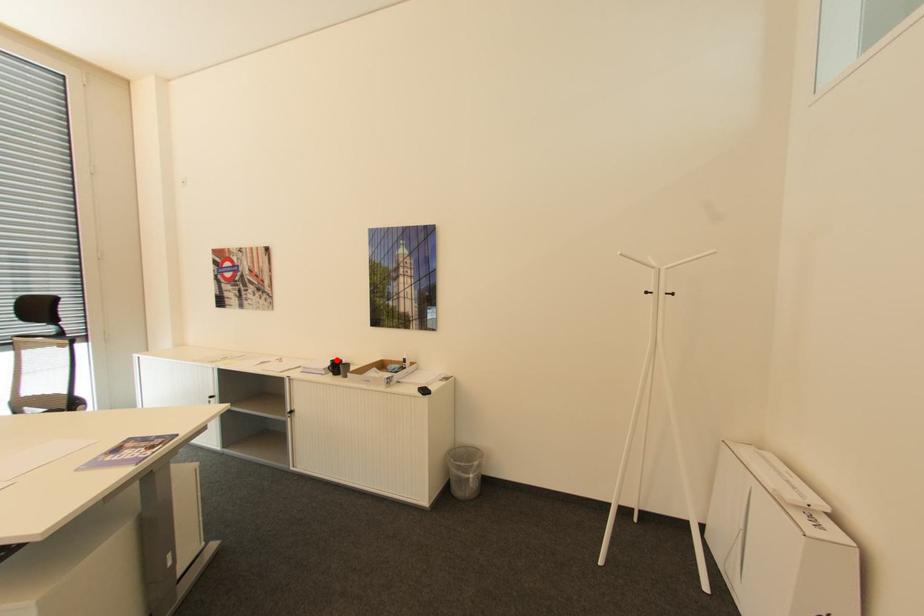
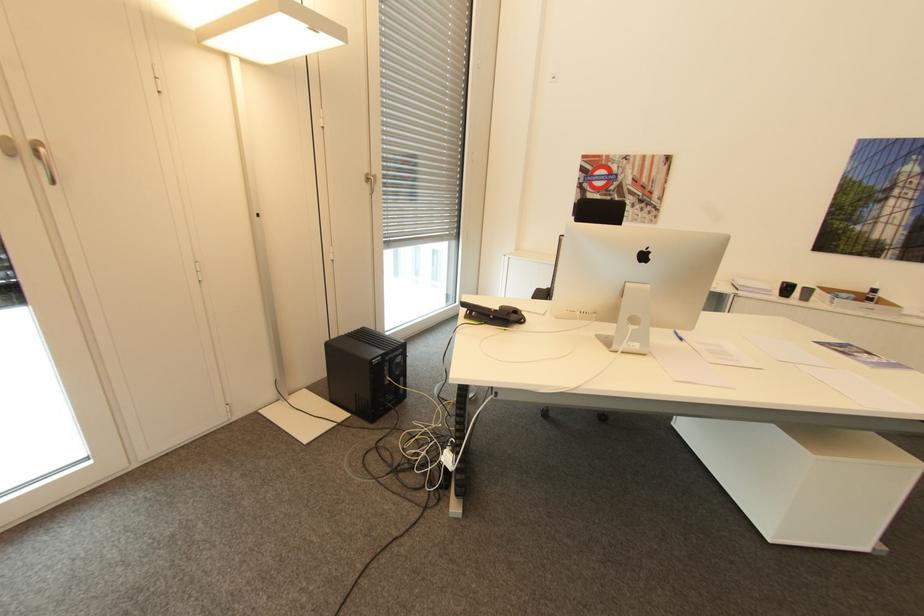
Find the pixel in the second image that matches the highlighted location in the first image.

(788, 283)